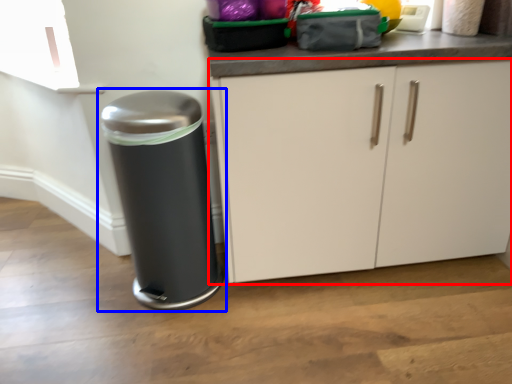
Question: Which object is closer to the camera taking this photo, cabinetry (highlighted by a red box) or waste container (highlighted by a blue box)?

Choices:
 (A) cabinetry
 (B) waste container

Answer: (A)